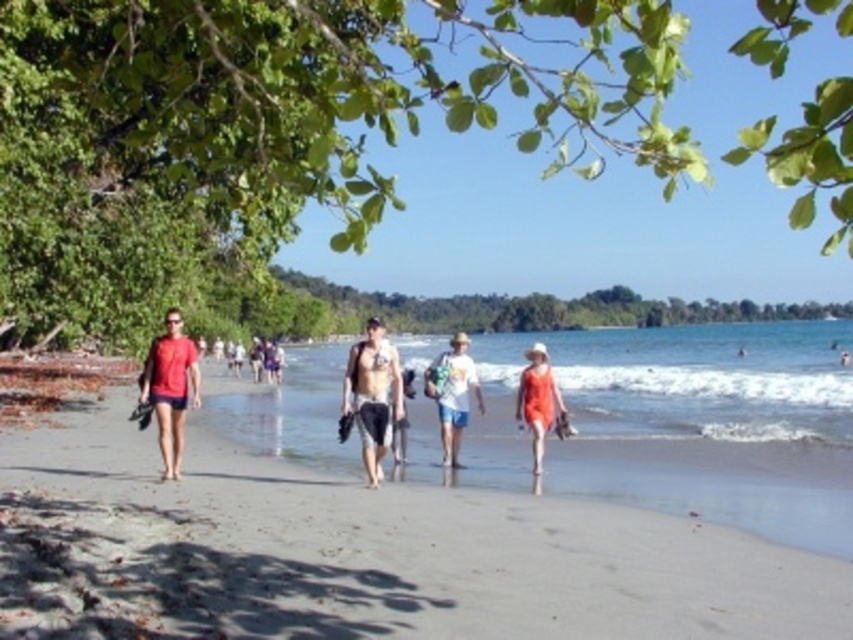
You are standing on the beach and notice a specific location marked by the coordinates point [360,554]. Based on the scene description, what type of terrain would you expect to find at that point?

The point [360,554] indicates light brown sand at center, so you would expect to find light brown sand at that location.

You are a photographer trying to capture a wide shot of the beach scene. You notice the matte red shirt at left and the matte black shorts at center. Which object would require you to zoom in more to focus on its details?

The matte red shirt at left has a lesser width compared to the matte black shorts at center, so you would need to zoom in more on the matte red shirt at left to focus on its details since it is smaller in size.

You are standing at the point marked as point (451, 394) on the beach. What item is located exactly at this point?

The white cotton shirt at center is located exactly at point (451, 394).